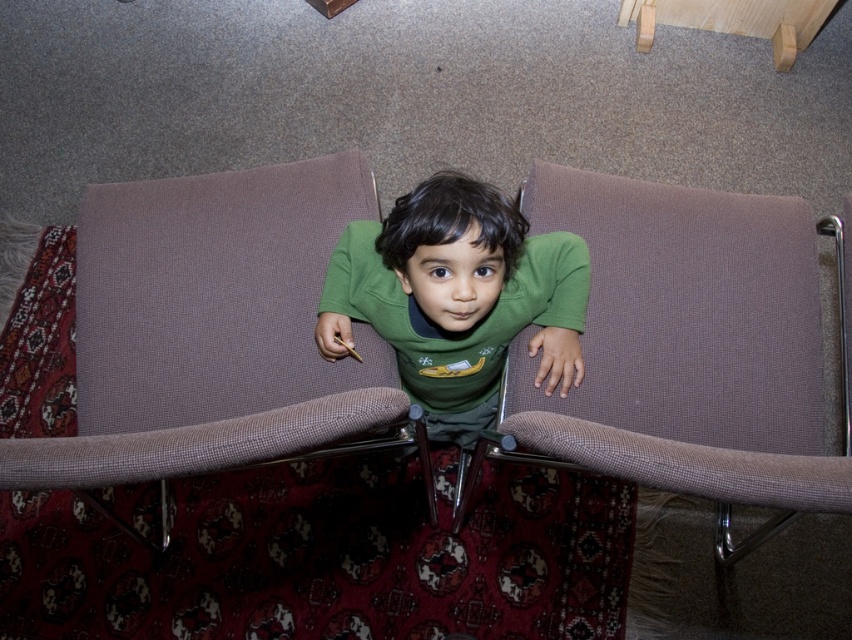
You are a photographer setting up a shoot and need to position a light source to the right of both the brown fabric couch at left and the brown fabric couch at center. Based on their positions, which couch should the light be placed to the right of?

The light should be placed to the right of the brown fabric couch at center because it is the rightmost couch, so placing the light to its right ensures it is to the right of both.

You are helping arrange a living room and need to place a large rectangular coffee table between the brown fabric couch at left and the brown fabric couch at center. Considering their widths, which couch should the coffee table be closer to?

The coffee table should be closer to the brown fabric couch at left because it has a smaller width compared to the brown fabric couch at center, allowing for better balance in the arrangement.